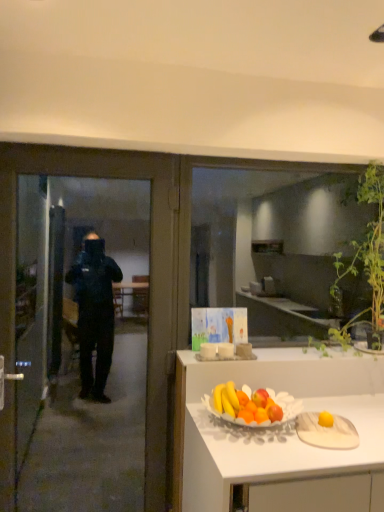
Question: Does transparent glass window at center have a lesser width compared to green leafy plant at upper right?

Choices:
 (A) no
 (B) yes

Answer: (B)

Question: From the image's perspective, is transparent glass window at center located beneath green leafy plant at upper right?

Choices:
 (A) no
 (B) yes

Answer: (A)

Question: Is transparent glass window at center facing away from green leafy plant at upper right?

Choices:
 (A) no
 (B) yes

Answer: (B)

Question: Is transparent glass window at center further to camera compared to green leafy plant at upper right?

Choices:
 (A) yes
 (B) no

Answer: (A)

Question: Is transparent glass window at center not within green leafy plant at upper right?

Choices:
 (A) no
 (B) yes

Answer: (A)

Question: Does transparent glass window at center touch green leafy plant at upper right?

Choices:
 (A) no
 (B) yes

Answer: (A)

Question: Does transparent glass door at left have a lesser width compared to transparent glass window at center?

Choices:
 (A) no
 (B) yes

Answer: (A)

Question: From the image's perspective, is transparent glass door at left located above transparent glass window at center?

Choices:
 (A) no
 (B) yes

Answer: (A)

Question: Are transparent glass door at left and transparent glass window at center beside each other?

Choices:
 (A) no
 (B) yes

Answer: (A)

Question: Considering the relative sizes of transparent glass door at left and transparent glass window at center in the image provided, is transparent glass door at left wider than transparent glass window at center?

Choices:
 (A) no
 (B) yes

Answer: (B)

Question: Is transparent glass door at left positioned with its back to transparent glass window at center?

Choices:
 (A) yes
 (B) no

Answer: (B)

Question: Is transparent glass door at left positioned behind transparent glass window at center?

Choices:
 (A) yes
 (B) no

Answer: (B)

Question: Is transparent glass window at center aimed at transparent glass door at left?

Choices:
 (A) no
 (B) yes

Answer: (A)